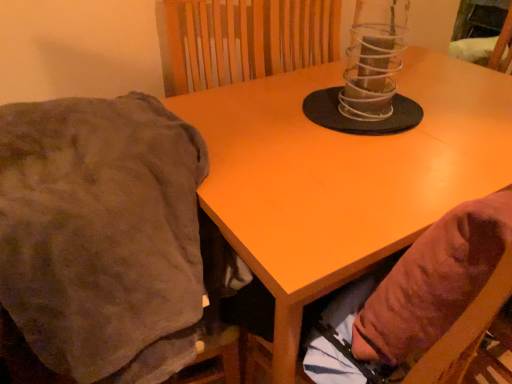
Question: Should I look upward or downward to see brown fabric bean bag chair at lower right?

Choices:
 (A) up
 (B) down

Answer: (B)

Question: Is clear plastic candle holder at center not within brown fuzzy blanket at left?

Choices:
 (A) no
 (B) yes

Answer: (B)

Question: Does clear plastic candle holder at center have a lesser height compared to brown fuzzy blanket at left?

Choices:
 (A) yes
 (B) no

Answer: (A)

Question: Can you confirm if clear plastic candle holder at center is bigger than brown fuzzy blanket at left?

Choices:
 (A) yes
 (B) no

Answer: (B)

Question: Could you tell me if clear plastic candle holder at center is turned towards brown fuzzy blanket at left?

Choices:
 (A) yes
 (B) no

Answer: (B)

Question: Does clear plastic candle holder at center appear on the right side of brown fuzzy blanket at left?

Choices:
 (A) yes
 (B) no

Answer: (A)

Question: From the image's perspective, is clear plastic candle holder at center beneath brown fuzzy blanket at left?

Choices:
 (A) yes
 (B) no

Answer: (B)

Question: Is brown fabric bean bag chair at lower right next to brown fuzzy blanket at left?

Choices:
 (A) no
 (B) yes

Answer: (A)

Question: Considering the relative positions of brown fabric bean bag chair at lower right and brown fuzzy blanket at left in the image provided, is brown fabric bean bag chair at lower right to the right of brown fuzzy blanket at left from the viewer's perspective?

Choices:
 (A) no
 (B) yes

Answer: (B)

Question: Can you confirm if brown fabric bean bag chair at lower right is smaller than brown fuzzy blanket at left?

Choices:
 (A) no
 (B) yes

Answer: (B)

Question: Is brown fabric bean bag chair at lower right facing away from brown fuzzy blanket at left?

Choices:
 (A) yes
 (B) no

Answer: (B)

Question: Could brown fuzzy blanket at left be considered to be inside brown fabric bean bag chair at lower right?

Choices:
 (A) yes
 (B) no

Answer: (B)

Question: Is brown fabric bean bag chair at lower right bigger than brown fuzzy blanket at left?

Choices:
 (A) no
 (B) yes

Answer: (A)

Question: Is matte orange table at center at the back of clear plastic candle holder at center?

Choices:
 (A) yes
 (B) no

Answer: (B)